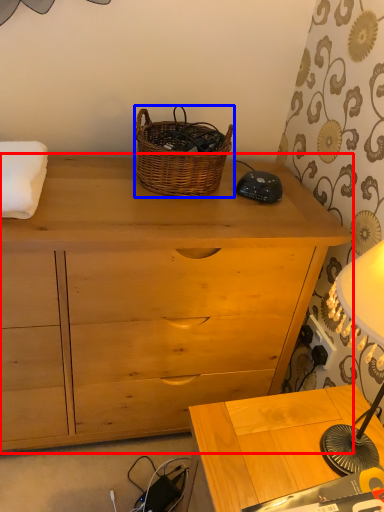
Question: Which object appears farthest to the camera in this image, chest of drawers (highlighted by a red box) or picnic basket (highlighted by a blue box)?

Choices:
 (A) chest of drawers
 (B) picnic basket

Answer: (B)